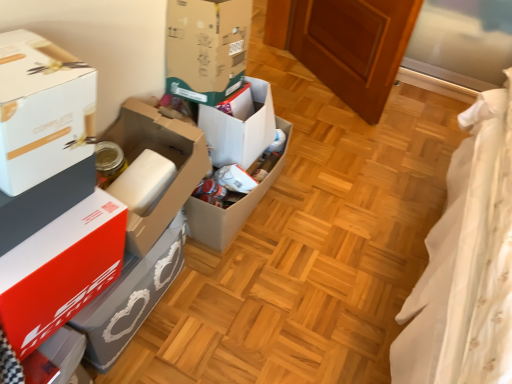
Question: Can you confirm if white cardboard box at left, the sixth box from the back, is taller than white cardboard box at left, positioned as the 3th box in front-to-back order?

Choices:
 (A) yes
 (B) no

Answer: (B)

Question: Is white cardboard box at left, which is counted as the first box, starting from the front, outside of white cardboard box at left, positioned as the 3th box in front-to-back order?

Choices:
 (A) yes
 (B) no

Answer: (A)

Question: Is white cardboard box at left, the sixth box from the back, further to camera compared to white cardboard box at left, which is the 4th box from back to front?

Choices:
 (A) yes
 (B) no

Answer: (B)

Question: Does white cardboard box at left, the sixth box from the back, have a larger size compared to white cardboard box at left, positioned as the 3th box in front-to-back order?

Choices:
 (A) no
 (B) yes

Answer: (A)

Question: Considering the relative positions of white cardboard box at left, which is counted as the first box, starting from the front, and white cardboard box at left, positioned as the 3th box in front-to-back order, in the image provided, is white cardboard box at left, which is counted as the first box, starting from the front, to the left of white cardboard box at left, positioned as the 3th box in front-to-back order, from the viewer's perspective?

Choices:
 (A) no
 (B) yes

Answer: (B)

Question: Is white cardboard box at left, the sixth box from the back, thinner than white cardboard box at left, positioned as the 3th box in front-to-back order?

Choices:
 (A) no
 (B) yes

Answer: (B)

Question: Does white cardboard box at center, arranged as the first box when viewed from the back, have a lesser height compared to white cardboard box at left, which is counted as the first box, starting from the front?

Choices:
 (A) yes
 (B) no

Answer: (A)

Question: From the image's perspective, is white cardboard box at center, arranged as the first box when viewed from the back, on white cardboard box at left, the sixth box from the back?

Choices:
 (A) no
 (B) yes

Answer: (B)

Question: Can you see white cardboard box at center, arranged as the first box when viewed from the back, touching white cardboard box at left, the sixth box from the back?

Choices:
 (A) yes
 (B) no

Answer: (B)

Question: Is white cardboard box at center, arranged as the sixth box when viewed from the front, facing away from white cardboard box at left, which is counted as the first box, starting from the front?

Choices:
 (A) no
 (B) yes

Answer: (A)

Question: Is white cardboard box at center, arranged as the sixth box when viewed from the front, at the left side of white cardboard box at left, which is counted as the first box, starting from the front?

Choices:
 (A) yes
 (B) no

Answer: (B)

Question: Is there a large distance between white cardboard box at center, arranged as the first box when viewed from the back, and white cardboard box at left, the sixth box from the back?

Choices:
 (A) no
 (B) yes

Answer: (A)

Question: Is white cardboard box at left, the sixth box from the back, positioned behind cardboard box at center, the 4th box from the front?

Choices:
 (A) no
 (B) yes

Answer: (A)